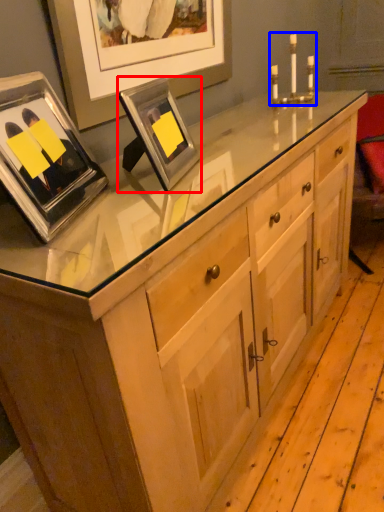
Question: Which object appears farthest to the camera in this image, picture frame (highlighted by a red box) or candle holder (highlighted by a blue box)?

Choices:
 (A) picture frame
 (B) candle holder

Answer: (B)